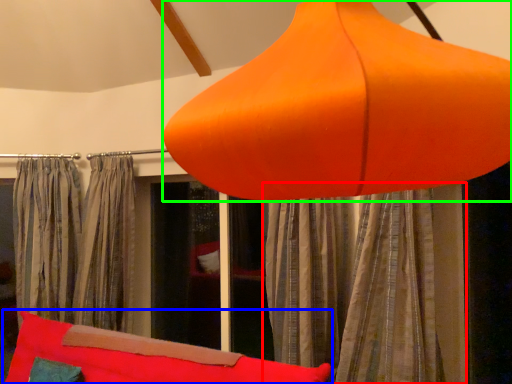
Question: Considering the real-world distances, which object is closest to curtain (highlighted by a red box)? bean bag chair (highlighted by a blue box) or lamp (highlighted by a green box).

Choices:
 (A) bean bag chair
 (B) lamp

Answer: (A)